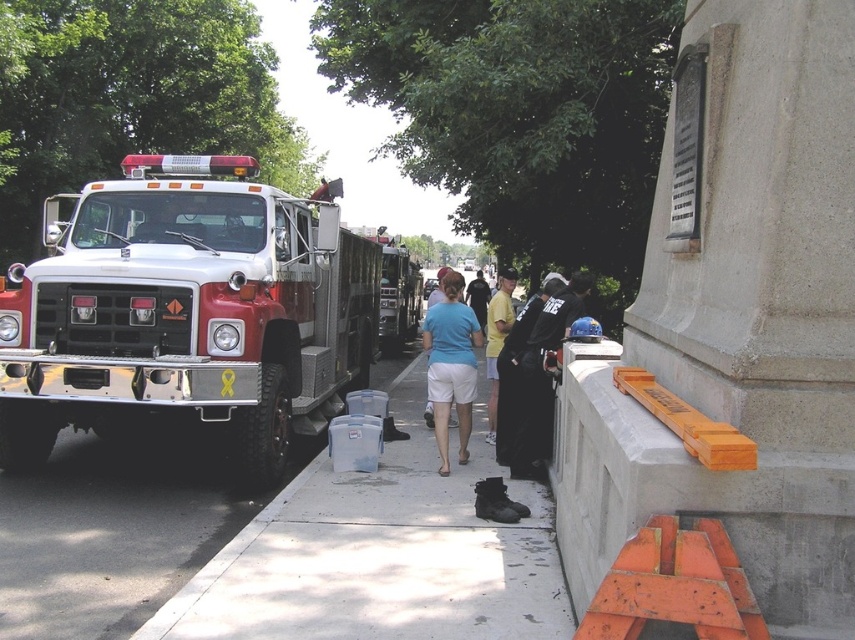
Which is in front, point (455, 320) or point (476, 305)?

Positioned in front is point (455, 320).

Is blue cotton shirt at center shorter than light blue shirt at center?

Indeed, blue cotton shirt at center has a lesser height compared to light blue shirt at center.

Measure the distance between point (445,444) and camera.

The distance of point (445,444) from camera is 6.83 meters.

At what (x,y) coordinates should I click in order to perform the action: click on blue cotton shirt at center. Please return your answer as a coordinate pair (x, y). The image size is (855, 640). Looking at the image, I should click on (451, 364).

Find the location of a particular element. This screenshot has width=855, height=640. red metallic fire truck at left is located at coordinates (187, 312).

Is red metallic fire truck at left to the right of blue cotton shirt at center from the viewer's perspective?

Incorrect, red metallic fire truck at left is not on the right side of blue cotton shirt at center.

In order to click on red metallic fire truck at left in this screenshot , I will do `click(187, 312)`.

Which of these two, red metallic fire truck at left or black fabric jacket at center, stands taller?

black fabric jacket at center

Between red metallic fire truck at left and black fabric jacket at center, which one appears on the left side from the viewer's perspective?

red metallic fire truck at left

Image resolution: width=855 pixels, height=640 pixels. What are the coordinates of `red metallic fire truck at left` in the screenshot? It's located at (187, 312).

Identify the location of red metallic fire truck at left. This screenshot has width=855, height=640. (187, 312).